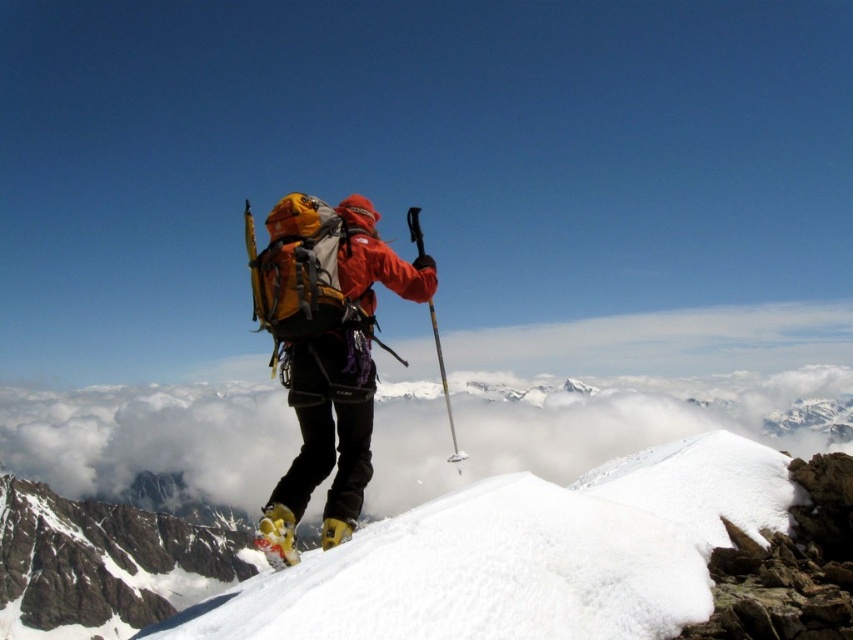
Question: Which point is closer to the camera?

Choices:
 (A) pos(271,516)
 (B) pos(367,340)
 (C) pos(437,332)

Answer: (A)

Question: Can you confirm if yellow matte ski at center is thinner than yellow metallic ski pole at center?

Choices:
 (A) yes
 (B) no

Answer: (B)

Question: Can you confirm if matte orange jacket at center is smaller than yellow metallic ski pole at center?

Choices:
 (A) yes
 (B) no

Answer: (A)

Question: Which of the following is the closest to the observer?

Choices:
 (A) (347, 420)
 (B) (445, 400)

Answer: (A)

Question: Can you confirm if yellow matte ski at center is positioned to the left of yellow metallic ski pole at center?

Choices:
 (A) no
 (B) yes

Answer: (B)

Question: Which point is closer to the camera taking this photo?

Choices:
 (A) (408, 224)
 (B) (352, 435)
 (C) (292, 556)

Answer: (C)